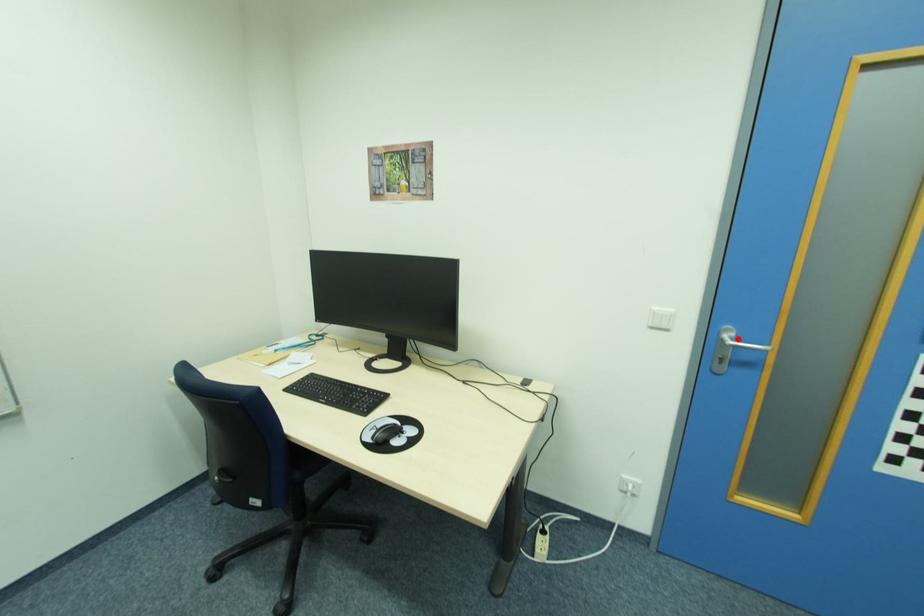
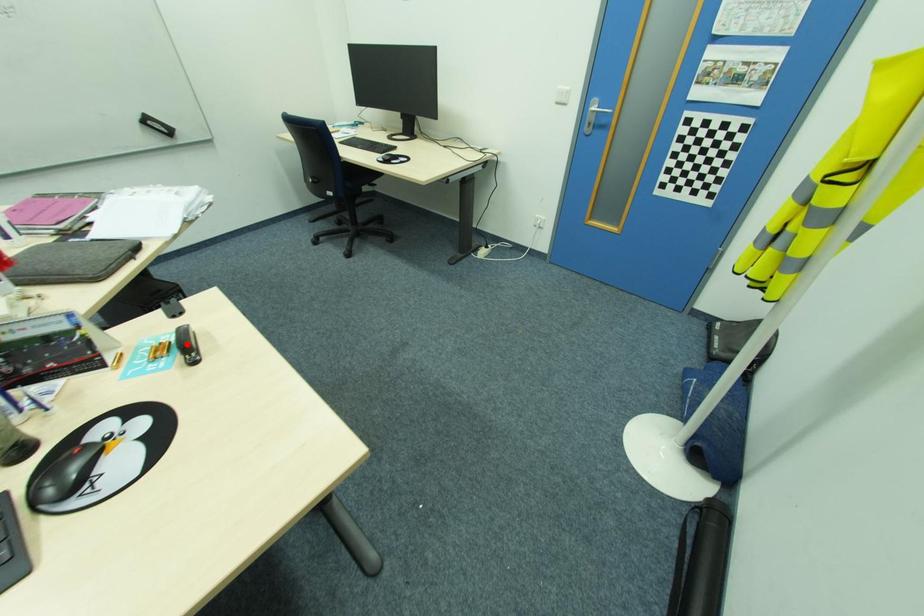
I am providing you with two images of the same scene from different viewpoints. A red point is marked on the first image and another point is marked on the second image. Do the highlighted points in image1 and image2 indicate the same real-world spot?

No